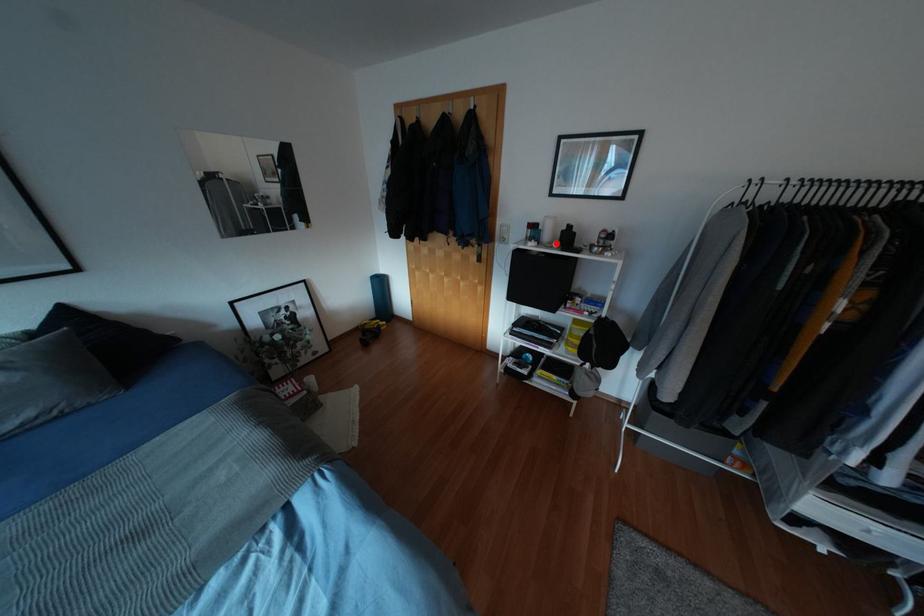
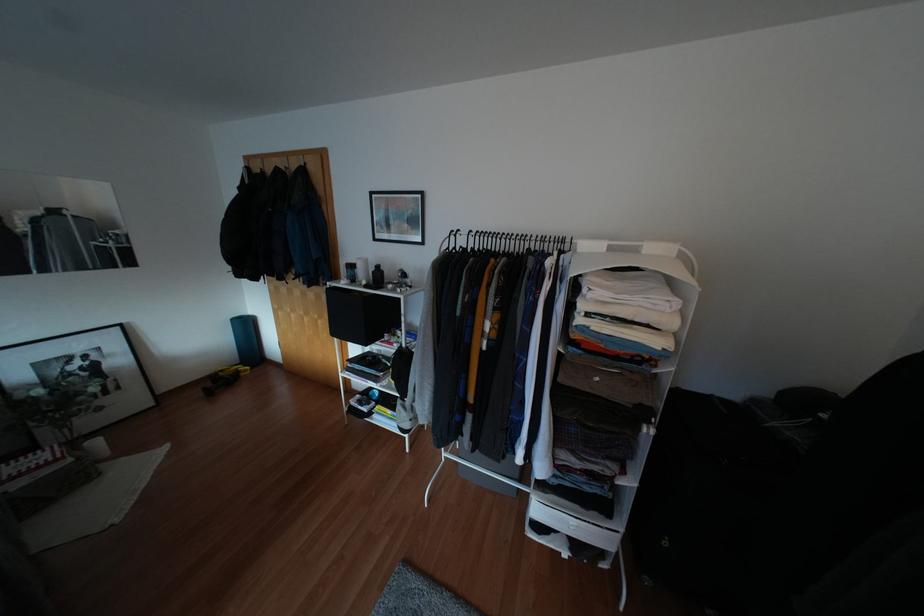
The point at the highlighted location is marked in the first image. Where is the corresponding point in the second image?

(362, 282)